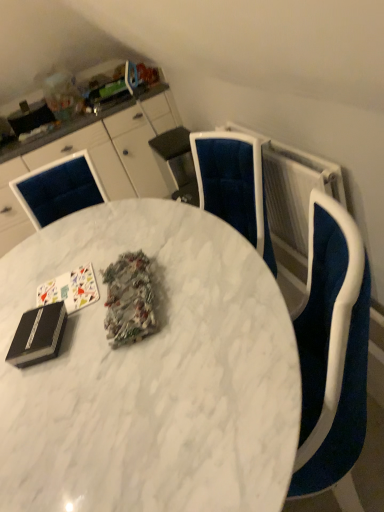
In order to click on vacant space behind white matte card game at upper left in this screenshot , I will do `click(64, 260)`.